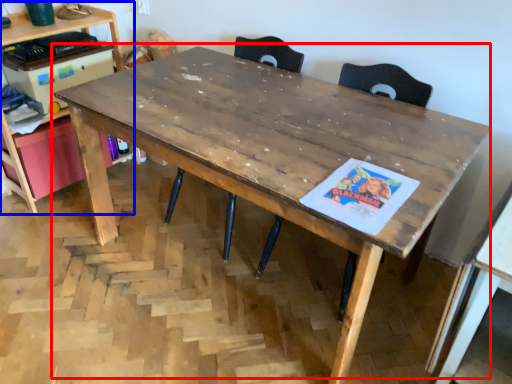
Question: Which point is closer to the camera, table (highlighted by a red box) or computer desk (highlighted by a blue box)?

Choices:
 (A) table
 (B) computer desk

Answer: (A)